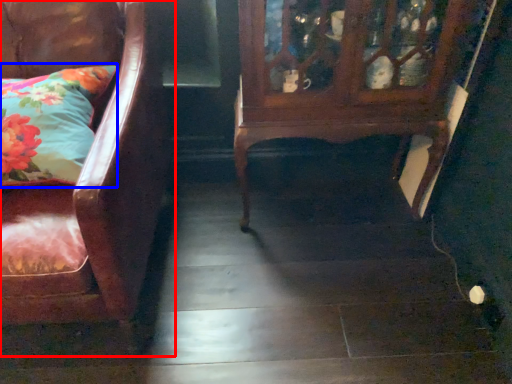
Question: Which object appears farthest to the camera in this image, chair (highlighted by a red box) or pillow (highlighted by a blue box)?

Choices:
 (A) chair
 (B) pillow

Answer: (B)